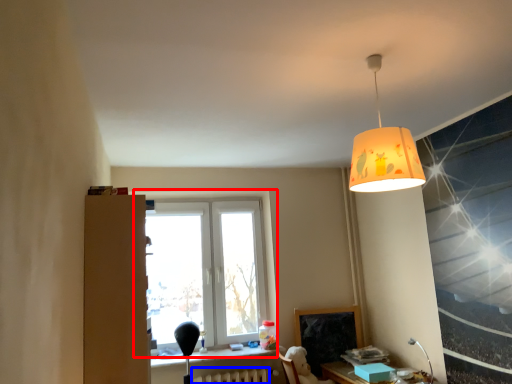
Question: Among these objects, which one is nearest to the camera, window (highlighted by a red box) or radiator (highlighted by a blue box)?

Choices:
 (A) window
 (B) radiator

Answer: (B)